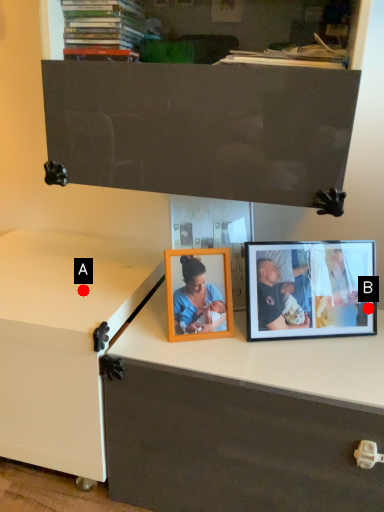
Question: Two points are circled on the image, labeled by A and B beside each circle. Which of the following is the closest to the observer?

Choices:
 (A) A is closer
 (B) B is closer

Answer: (B)